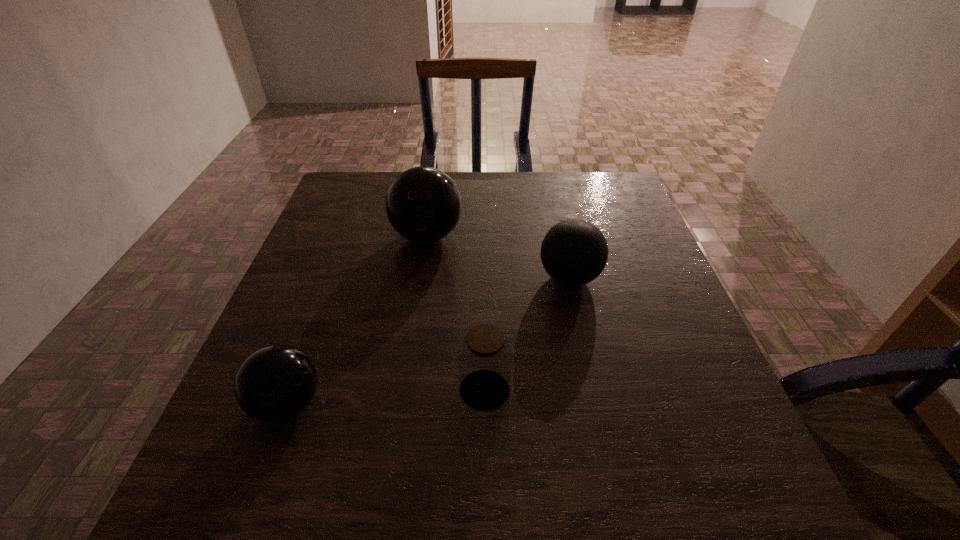
The image size is (960, 540). In order to click on unoccupied position between the rightmost object and the jar in this screenshot , I will do pyautogui.click(x=527, y=334).

Choose which object is the second nearest neighbor to the tallest bowling ball. Please provide its 2D coordinates. Your answer should be formatted as a tuple, i.e. [(x, y)], where the tuple contains the x and y coordinates of a point satisfying the conditions above.

[(484, 358)]

Identify which object is the second closest to the leftmost bowling ball. Please provide its 2D coordinates. Your answer should be formatted as a tuple, i.e. [(x, y)], where the tuple contains the x and y coordinates of a point satisfying the conditions above.

[(423, 204)]

Locate an element on the screen. The height and width of the screenshot is (540, 960). the second closest bowling ball to the jar is located at coordinates click(x=275, y=383).

Find the location of a particular element. bowling ball that stands as the closest to the tallest bowling ball is located at coordinates (574, 252).

This screenshot has width=960, height=540. In order to click on vacant area in the image that satisfies the following two spatial constraints: 1. on the surface of the jar near the finger holes; 2. on the right side of the tallest object in this screenshot , I will do [x=404, y=390].

The image size is (960, 540). I want to click on vacant point that satisfies the following two spatial constraints: 1. on the grip area of the rightmost object; 2. on the front side of the second object from right to left, so click(594, 390).

Locate an element on the screen. The width and height of the screenshot is (960, 540). vacant space that satisfies the following two spatial constraints: 1. on the surface of the tallest object near the finger holes; 2. on the side of the leftmost object with the finger holes is located at coordinates [402, 403].